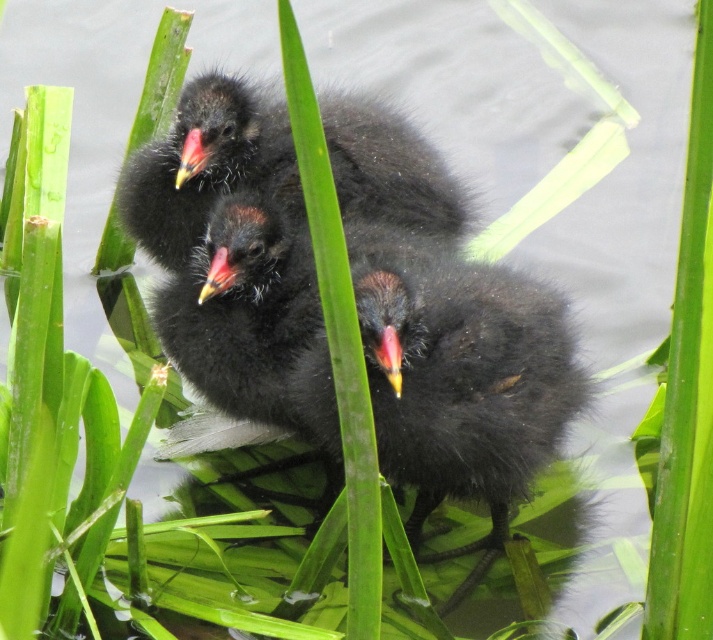
You are a wildlife photographer aiming to capture a closeup shot of the black fluffy birds at upper center. Given that your camera has a focal length of 200mm and you are currently positioned at point A, which is at coordinates 0.5, 0.5, can you estimate whether you need to move closer or farther away to focus on the birds?

The black fluffy birds at upper center are located at point (207,164). Since your current position is at (356,320), you need to move closer to the birds to focus on them with your 200mm lens.

You are a photographer trying to capture a closeup of the birds in the scene. You notice two points marked in the image, point 1 at coordinates point (366, 131) and point 2 at coordinates point (389, 358). Which point is closer to the camera, point 1 or point 2?

Point 1 at coordinates point (366, 131) is closer to the camera than point 2 at coordinates point (389, 358) because the Objects Description states that point (366, 131) is further to the viewer than point (389, 358).